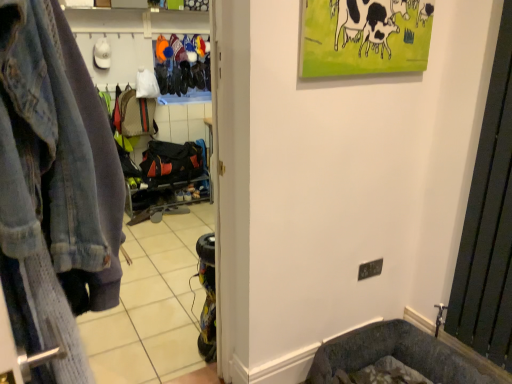
Question: Is faded denim jacket at left surrounded by black metal radiator at right?

Choices:
 (A) yes
 (B) no

Answer: (B)

Question: Does black metal radiator at right appear on the left side of faded denim jacket at left?

Choices:
 (A) no
 (B) yes

Answer: (A)

Question: Considering the relative positions of black metal radiator at right and faded denim jacket at left in the image provided, is black metal radiator at right in front of faded denim jacket at left?

Choices:
 (A) no
 (B) yes

Answer: (A)

Question: Does black metal radiator at right have a larger size compared to faded denim jacket at left?

Choices:
 (A) no
 (B) yes

Answer: (A)

Question: Would you say black metal radiator at right is a long distance from faded denim jacket at left?

Choices:
 (A) no
 (B) yes

Answer: (B)

Question: Relative to faded denim jacket at left, is faded denim jacket at left in front or behind?

Choices:
 (A) front
 (B) behind

Answer: (A)

Question: Considering the positions of point (58, 92) and point (114, 279), is point (58, 92) closer or farther from the camera than point (114, 279)?

Choices:
 (A) closer
 (B) farther

Answer: (A)

Question: Considering the positions of faded denim jacket at left and faded denim jacket at left in the image, is faded denim jacket at left taller or shorter than faded denim jacket at left?

Choices:
 (A) tall
 (B) short

Answer: (A)

Question: From a real-world perspective, is faded denim jacket at left physically located above or below faded denim jacket at left?

Choices:
 (A) above
 (B) below

Answer: (B)

Question: Considering the positions of faded denim jacket at left and faded denim jacket at left in the image, is faded denim jacket at left wider or thinner than faded denim jacket at left?

Choices:
 (A) thin
 (B) wide

Answer: (B)

Question: From the image's perspective, relative to faded denim jacket at left, is faded denim jacket at left above or below?

Choices:
 (A) below
 (B) above

Answer: (B)

Question: In the image, is faded denim jacket at left positioned in front of or behind faded denim jacket at left?

Choices:
 (A) front
 (B) behind

Answer: (B)

Question: In terms of size, does faded denim jacket at left appear bigger or smaller than faded denim jacket at left?

Choices:
 (A) big
 (B) small

Answer: (B)

Question: Considering the positions of black metal radiator at right and faded denim jacket at left in the image, is black metal radiator at right wider or thinner than faded denim jacket at left?

Choices:
 (A) wide
 (B) thin

Answer: (B)

Question: Considering their positions, is black metal radiator at right located in front of or behind faded denim jacket at left?

Choices:
 (A) behind
 (B) front

Answer: (A)